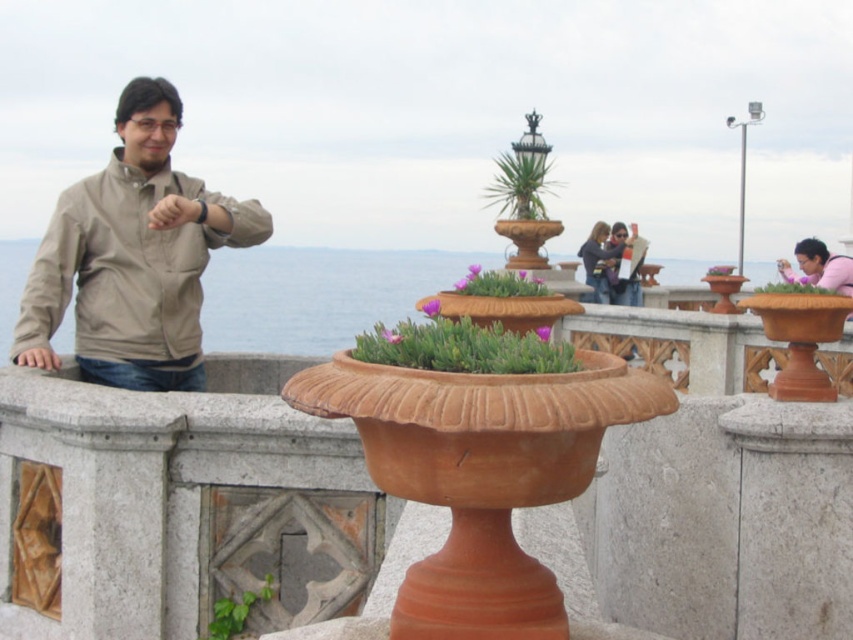
Question: Estimate the real-world distances between objects in this image. Which object is farther from the green leafy plant at lower left?

Choices:
 (A) beige fabric jacket at left
 (B) purple succulent at center
 (C) matte terracotta pot at center

Answer: (C)

Question: Does green leafy plant at upper center appear on the left side of green leafy plant at center?

Choices:
 (A) no
 (B) yes

Answer: (B)

Question: Can you confirm if pink matte flower pot at upper right is positioned to the left of matte terracotta pot at center?

Choices:
 (A) no
 (B) yes

Answer: (A)

Question: Is beige fabric jacket at left above matte terracotta pot at center?

Choices:
 (A) no
 (B) yes

Answer: (A)

Question: Among these objects, which one is nearest to the camera?

Choices:
 (A) green leafy plant at lower left
 (B) green leafy plant at center

Answer: (A)

Question: Estimate the real-world distances between objects in this image. Which object is closer to the purple succulent at center?

Choices:
 (A) green leafy plant at lower left
 (B) green leafy plant at upper center

Answer: (A)